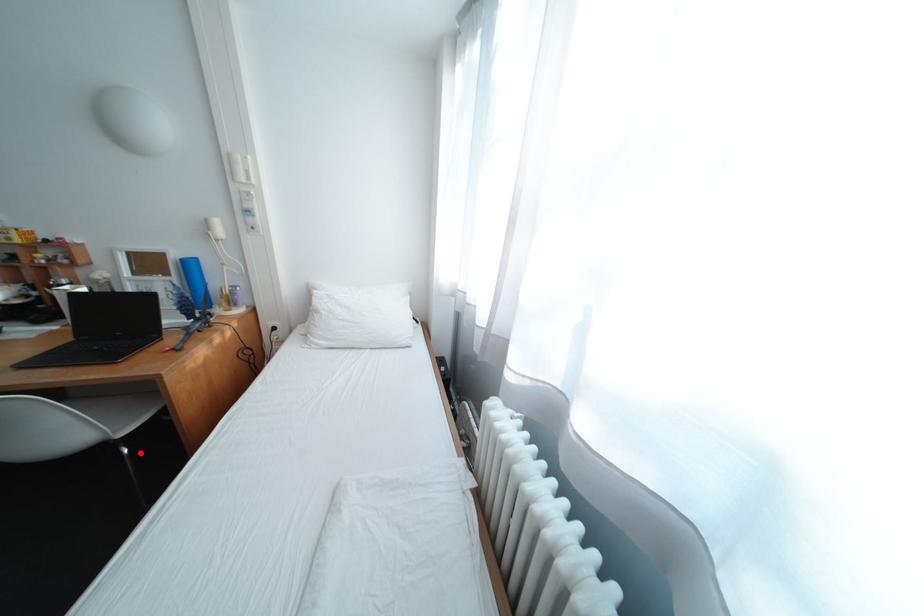
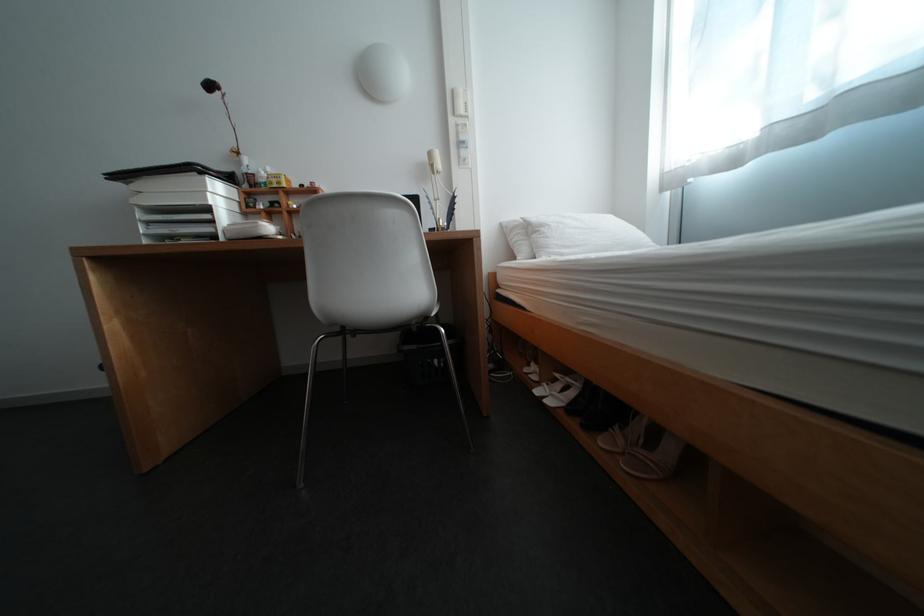
Locate, in the second image, the point that corresponds to the highlighted location in the first image.

(456, 331)